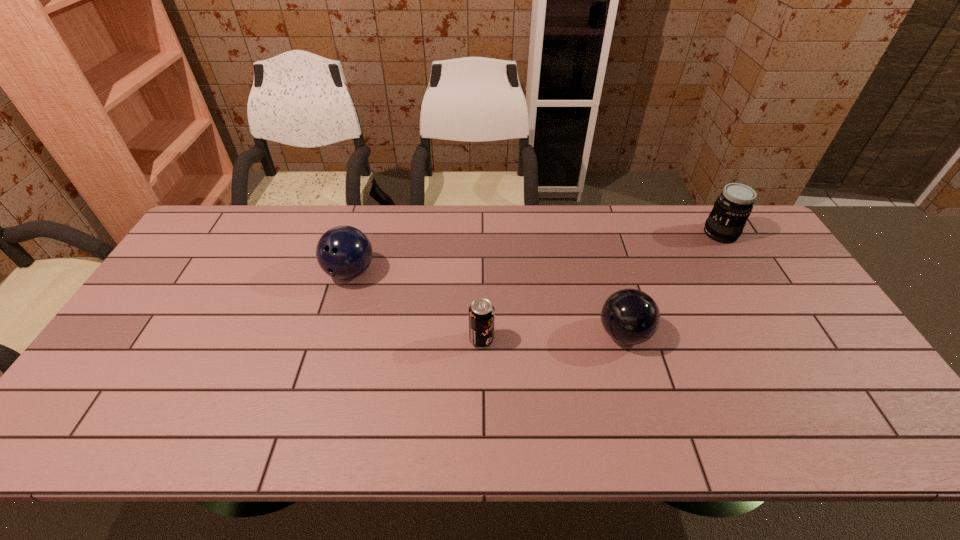
Locate an element on the screen. the farthest object is located at coordinates (725, 223).

Where is `telephoto lens`? The width and height of the screenshot is (960, 540). telephoto lens is located at coordinates (725, 223).

Locate an element on the screen. The image size is (960, 540). the leftmost object is located at coordinates (344, 252).

The height and width of the screenshot is (540, 960). Identify the location of the left bowling ball. (344, 252).

Where is `the third object from left to right`? the third object from left to right is located at coordinates (630, 316).

Where is `the right bowling ball`? The image size is (960, 540). the right bowling ball is located at coordinates (630, 316).

Locate an element on the screen. The height and width of the screenshot is (540, 960). the third object from right to left is located at coordinates (481, 314).

At what (x,y) coordinates should I click in order to perform the action: click on vacant space located 0.270m on the front of the farthest object. Please return your answer as a coordinate pair (x, y). This screenshot has height=540, width=960. Looking at the image, I should click on (765, 307).

Where is `free location located on the surface of the leftmost object near the finger holes`? free location located on the surface of the leftmost object near the finger holes is located at coordinates (318, 381).

Identify the location of free location located on the side of the second object from right to left with the finger holes. (544, 334).